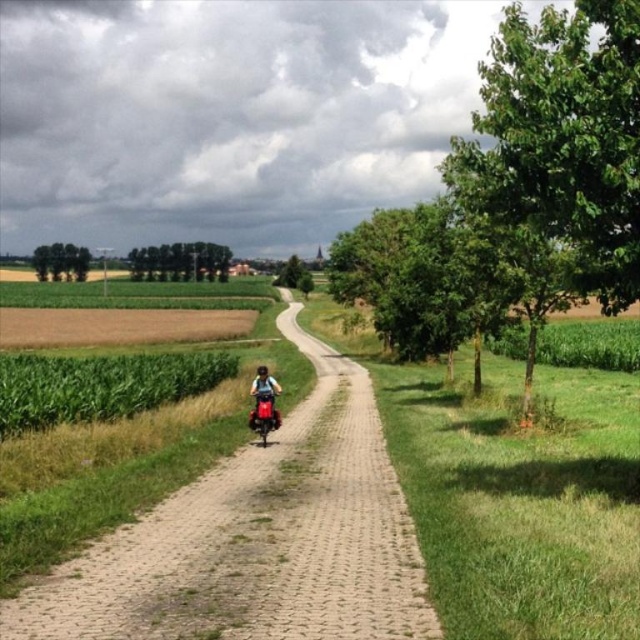
Between green matte corn field at left and metallic red motorcycle at center, which one appears on the left side from the viewer's perspective?

green matte corn field at left is more to the left.

Does green matte corn field at left appear under metallic red motorcycle at center?

Actually, green matte corn field at left is above metallic red motorcycle at center.

Describe the element at coordinates (100, 385) in the screenshot. Image resolution: width=640 pixels, height=640 pixels. I see `green matte corn field at left` at that location.

I want to click on green matte corn field at left, so click(100, 385).

Locate an element on the screen. This screenshot has height=640, width=640. paved brick path at center is located at coordinates click(x=259, y=538).

Does point (282, 556) come farther from viewer compared to point (214, 252)?

No, it is not.

What are the coordinates of `paved brick path at center` in the screenshot? It's located at (259, 538).

Can you confirm if green leafy trees at left is wider than green leafy tree at center?

Indeed, green leafy trees at left has a greater width compared to green leafy tree at center.

Between green leafy trees at left and green leafy tree at center, which one has more height?

With more height is green leafy tree at center.

This screenshot has height=640, width=640. What are the coordinates of `green leafy trees at left` in the screenshot? It's located at (60, 260).

The height and width of the screenshot is (640, 640). Find the location of `green leafy trees at left`. green leafy trees at left is located at coordinates (60, 260).